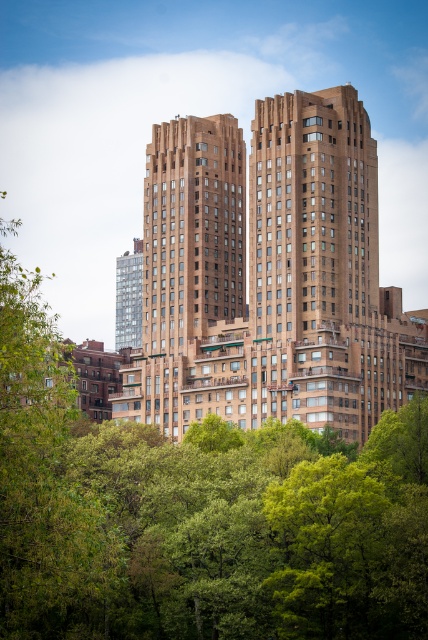
You are standing in the park and want to take a photo of the brown brick building at center without the green leafy tree at center blocking the view. Is the tree currently blocking the building in your camera frame?

The green leafy tree at center is closer to the viewer than the brown brick building at center, so the tree would block the view of the building in your camera frame.

You are standing in the park and want to take a photo of the green leafy tree at center and the green leafy tree at left. Which tree is closer to the camera when you look through the viewfinder?

The green leafy tree at center is positioned under the green leafy tree at left, meaning the green leafy tree at left is closer to the camera.